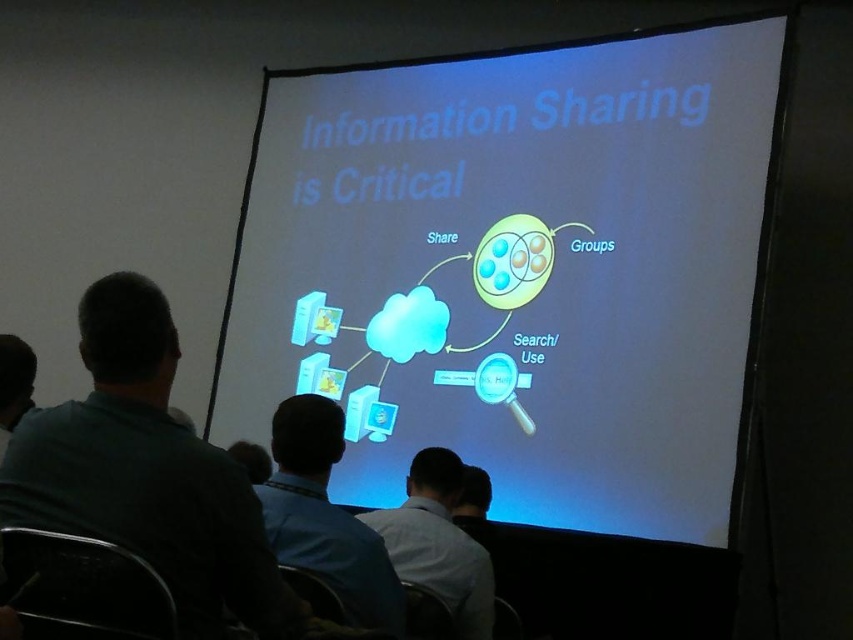
Does blue shirt at center have a greater width compared to gray shirt at lower center?

Incorrect, blue shirt at center's width does not surpass gray shirt at lower center's.

Can you confirm if blue shirt at center is taller than gray shirt at lower center?

Yes, blue shirt at center is taller than gray shirt at lower center.

Does point (299, 561) come in front of point (471, 564)?

That is True.

The width and height of the screenshot is (853, 640). I want to click on blue shirt at center, so click(323, 515).

Between green fabric shirt at left and blue shirt at center, which one appears on the right side from the viewer's perspective?

From the viewer's perspective, blue shirt at center appears more on the right side.

Which of these two, green fabric shirt at left or blue shirt at center, stands taller?

With more height is green fabric shirt at left.

Between point (241, 618) and point (318, 436), which one is positioned behind?

The point (318, 436) is behind.

Locate an element on the screen. The image size is (853, 640). green fabric shirt at left is located at coordinates (148, 472).

Who is positioned more to the right, white glossy projector screen at center or green fabric shirt at left?

Positioned to the right is white glossy projector screen at center.

Does point (498, 513) come in front of point (100, 445)?

That is False.

You are a GUI agent. You are given a task and a screenshot of the screen. Output one action in this format:
    pyautogui.click(x=<x>, y=<y>)
    Task: Click on the white glossy projector screen at center
    The height and width of the screenshot is (640, 853).
    Given the screenshot: What is the action you would take?
    pyautogui.click(x=517, y=269)